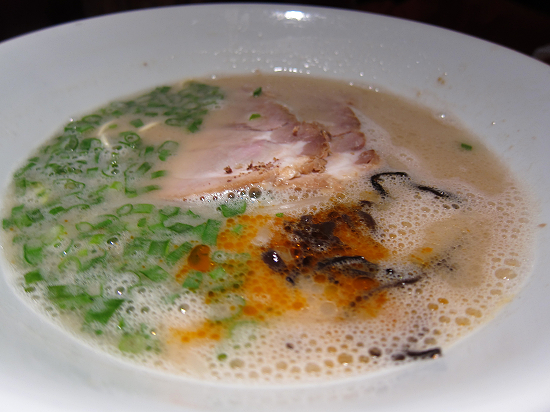
Where is `white bowl`? white bowl is located at coordinates (430, 58).